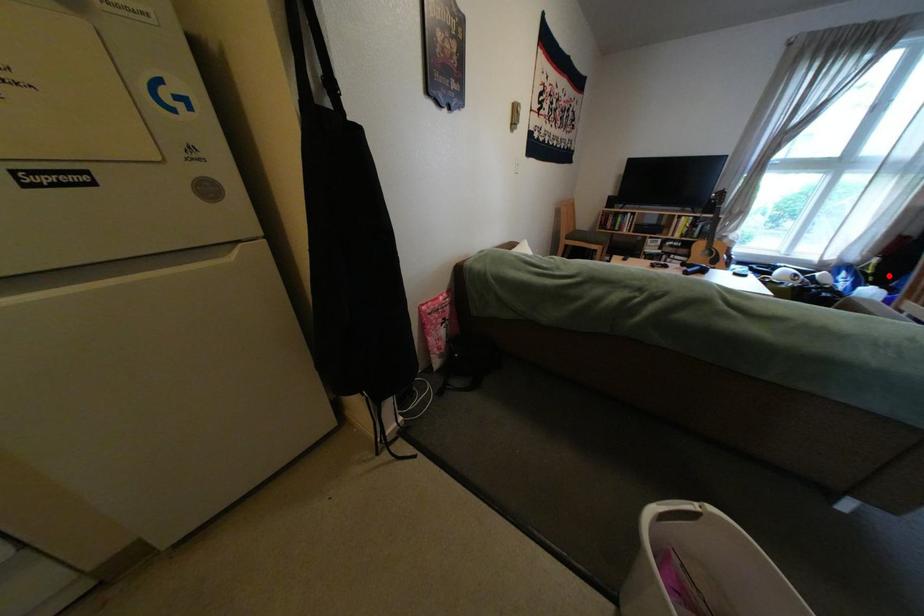
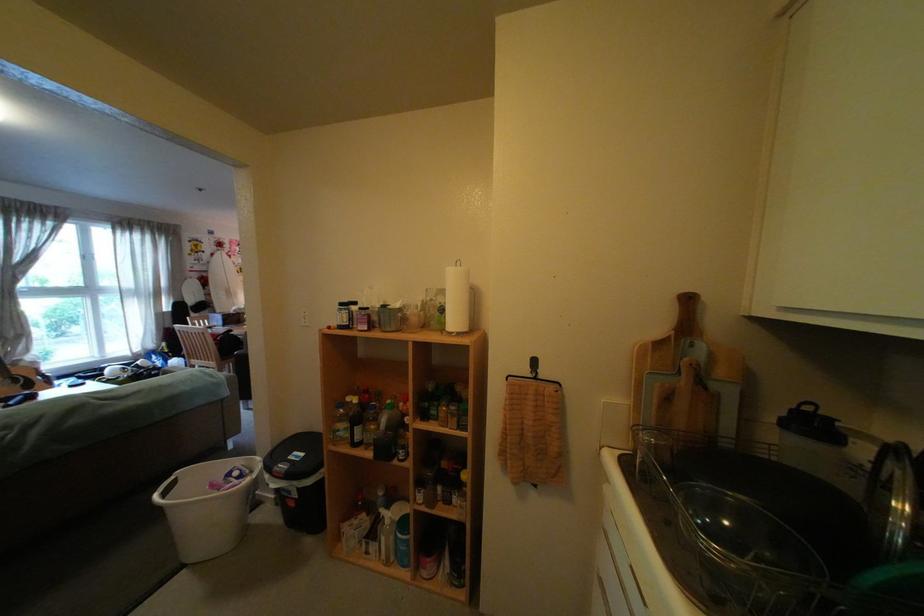
Find the pixel in the second image that matches the highlighted location in the first image.

(185, 353)